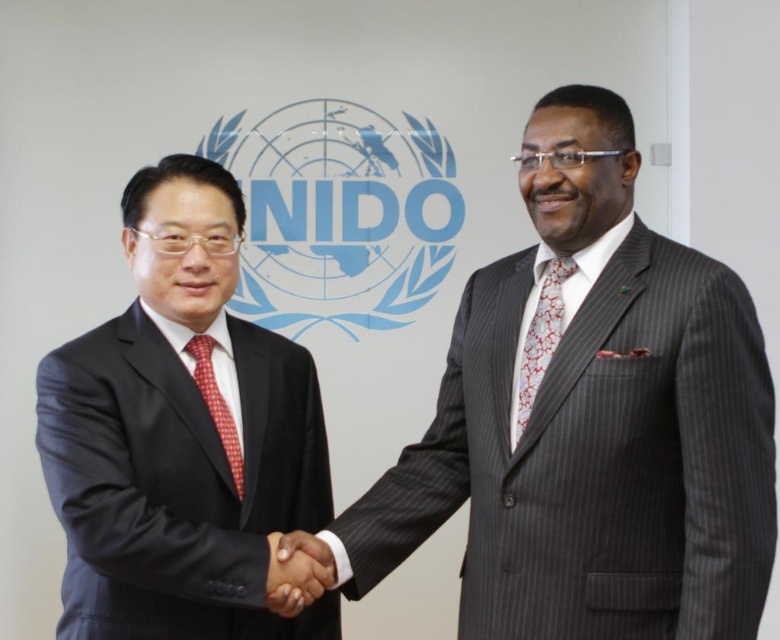
Question: Can you confirm if matte black suit at left is thinner than smooth skin handshake at center?

Choices:
 (A) yes
 (B) no

Answer: (B)

Question: Can you confirm if gray pinstripe suit at center is positioned to the left of red floral silk tie at center?

Choices:
 (A) no
 (B) yes

Answer: (A)

Question: Is gray pinstripe suit at center behind matte black suit at left?

Choices:
 (A) no
 (B) yes

Answer: (A)

Question: Which of the following is the farthest from the observer?

Choices:
 (A) (523, 378)
 (B) (211, 385)
 (C) (307, 550)
 (D) (385, 484)

Answer: (D)

Question: Which of the following is the farthest from the observer?

Choices:
 (A) matte black suit at left
 (B) gray pinstripe suit at center
 (C) red floral silk tie at center

Answer: (C)

Question: Which is farther from the smooth skin handshake at center?

Choices:
 (A) matte black suit at left
 (B) red checkered tie at center

Answer: (A)